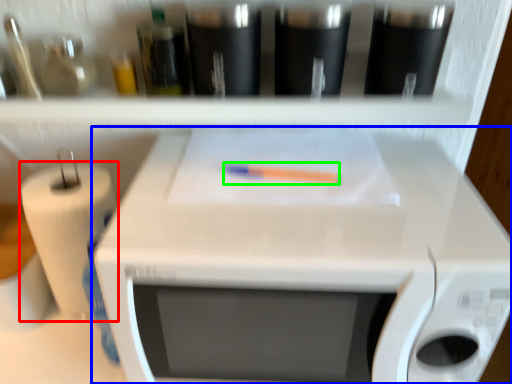
Question: Based on their relative distances, which object is nearer to paper towel (highlighted by a red box)? Choose from appliance (highlighted by a blue box) and crayon (highlighted by a green box).

Choices:
 (A) appliance
 (B) crayon

Answer: (A)